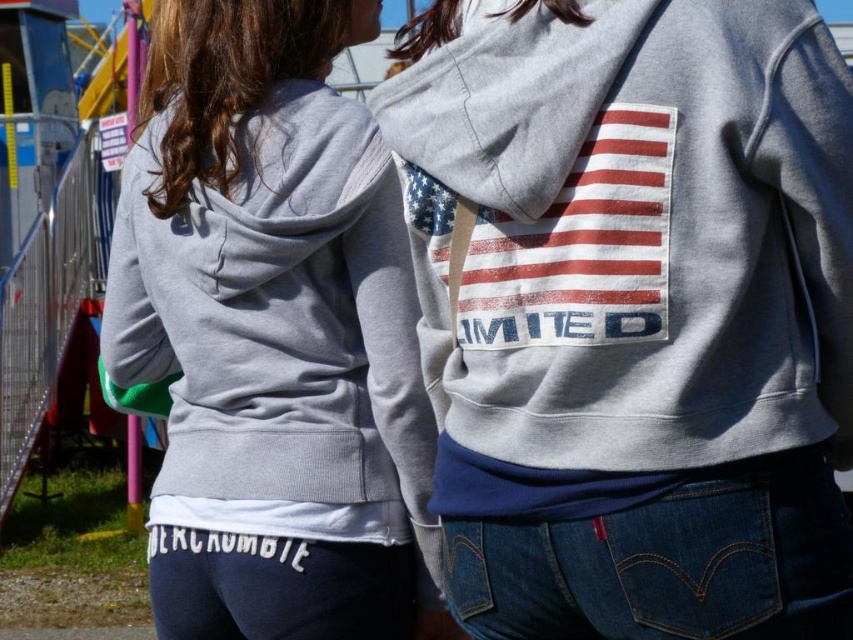
Question: Does matte gray hoodie at center have a greater width compared to distressed white flag at center?

Choices:
 (A) no
 (B) yes

Answer: (B)

Question: Which point appears farthest from the camera in this image?

Choices:
 (A) [587, 308]
 (B) [305, 68]
 (C) [430, 65]

Answer: (B)

Question: Which point is farther to the camera?

Choices:
 (A) (851, 236)
 (B) (614, 182)

Answer: (A)

Question: Can you confirm if gray heathered hoodie at center is bigger than distressed white flag at center?

Choices:
 (A) yes
 (B) no

Answer: (A)

Question: Estimate the real-world distances between objects in this image. Which object is closer to the gray heathered hoodie at center?

Choices:
 (A) distressed white flag at center
 (B) matte gray hoodie at center

Answer: (A)

Question: Can you confirm if matte gray hoodie at center is positioned to the right of distressed white flag at center?

Choices:
 (A) no
 (B) yes

Answer: (A)